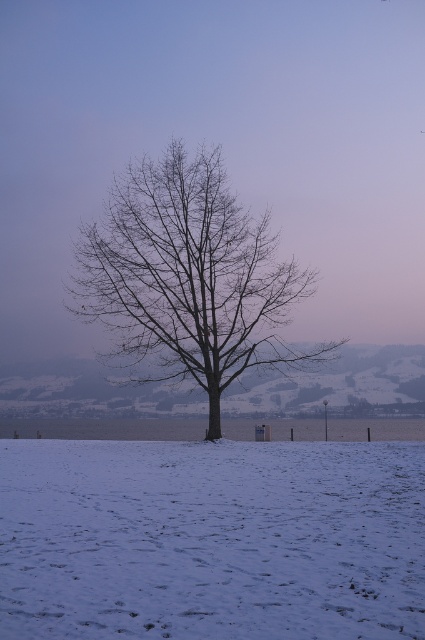
Question: Does white powdery snow at center have a larger size compared to bare wood tree at center?

Choices:
 (A) yes
 (B) no

Answer: (A)

Question: In this image, where is white powdery snow at center located relative to bare wood tree at center?

Choices:
 (A) left
 (B) right

Answer: (A)

Question: Does white powdery snow at center have a smaller size compared to bare wood tree at center?

Choices:
 (A) no
 (B) yes

Answer: (A)

Question: Which point is closer to the camera?

Choices:
 (A) (135, 316)
 (B) (362, 484)

Answer: (B)